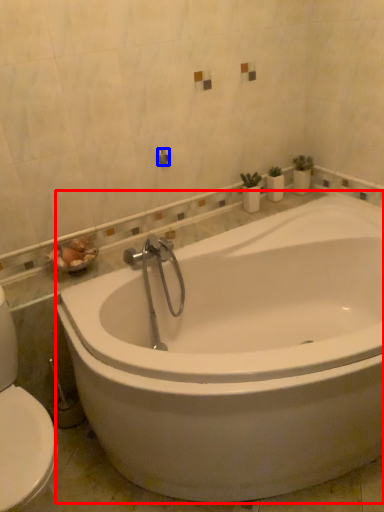
Question: Which object is closer to the camera taking this photo, bathtub (highlighted by a red box) or shower (highlighted by a blue box)?

Choices:
 (A) bathtub
 (B) shower

Answer: (A)